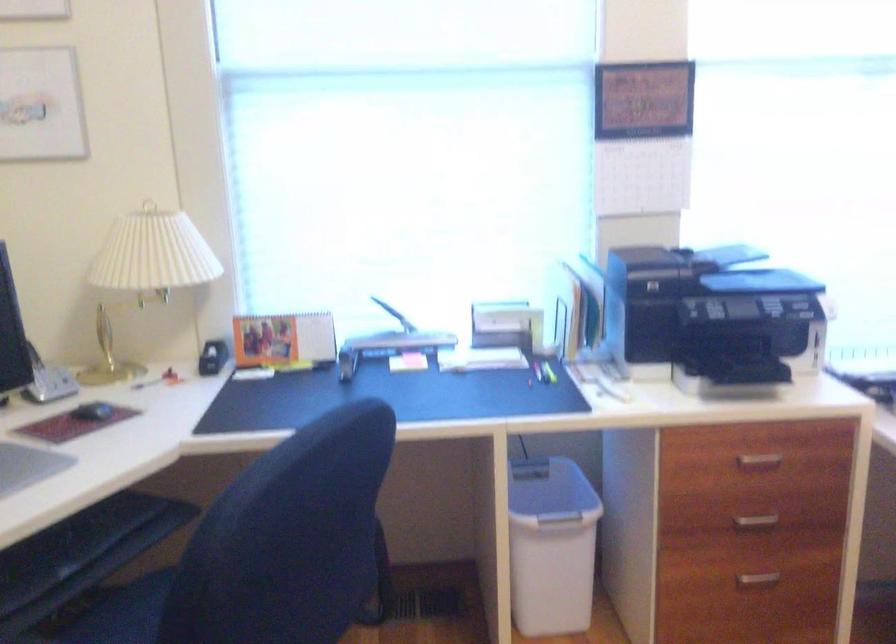
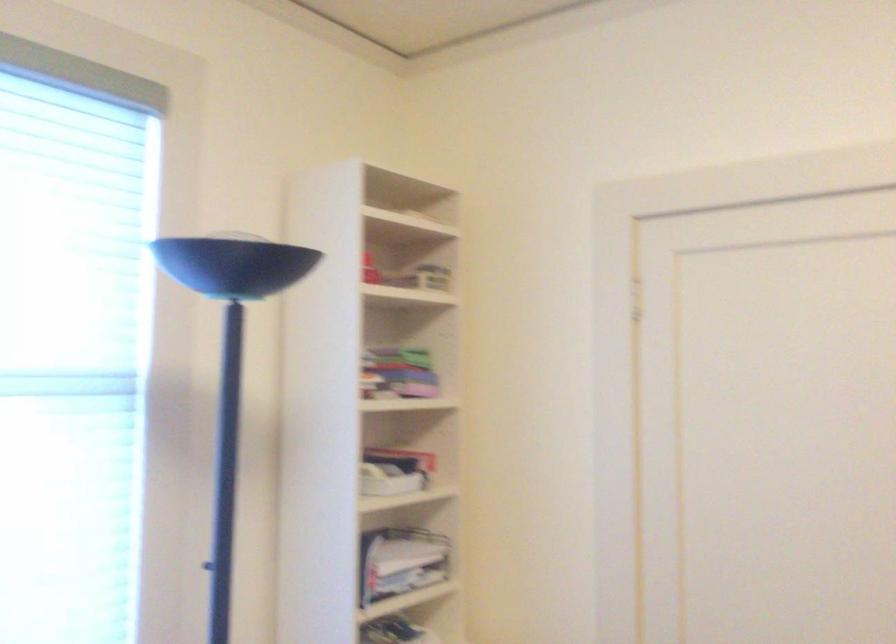
Consider the image. The first image is from the beginning of the video and the second image is from the end. How did the camera likely rotate when shooting the video?

The camera's rotation is toward right-up.